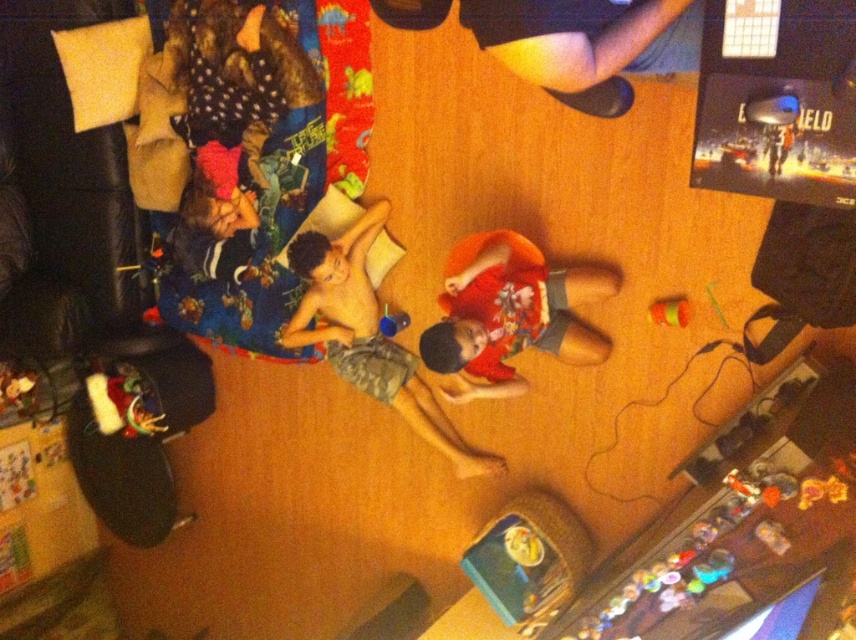
Question: Is black leather shoes at upper right above orange cotton shirt at center?

Choices:
 (A) yes
 (B) no

Answer: (A)

Question: Which object is closer to the camera taking this photo?

Choices:
 (A) black leather shoes at upper right
 (B) camouflage shorts at center

Answer: (A)

Question: Is black leather shoes at upper right smaller than camouflage shorts at center?

Choices:
 (A) no
 (B) yes

Answer: (B)

Question: Estimate the real-world distances between objects in this image. Which object is farther from the black leather shoes at upper right?

Choices:
 (A) camouflage shorts at center
 (B) orange cotton shirt at center

Answer: (A)

Question: Does black leather shoes at upper right come in front of camouflage shorts at center?

Choices:
 (A) no
 (B) yes

Answer: (B)

Question: Among these points, which one is farthest from the camera?

Choices:
 (A) (432, 436)
 (B) (462, 284)
 (C) (687, 64)

Answer: (A)